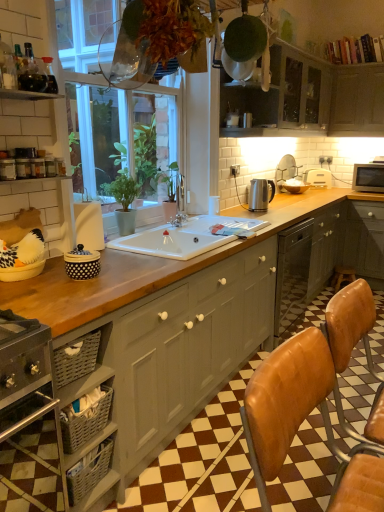
Image resolution: width=384 pixels, height=512 pixels. I want to click on white tiled window at upper left, so click(x=110, y=106).

The width and height of the screenshot is (384, 512). Describe the element at coordinates (110, 106) in the screenshot. I see `white tiled window at upper left` at that location.

Describe the element at coordinates (82, 263) in the screenshot. The height and width of the screenshot is (512, 384). I see `polka dot ceramic jar at left, which is the seventh appliance from back to front` at that location.

Describe the element at coordinates (318, 177) in the screenshot. The image size is (384, 512). I see `white plastic toaster at upper right, which ranks as the 2th appliance in right-to-left order` at that location.

Describe the element at coordinates (176, 239) in the screenshot. I see `white ceramic sink at center` at that location.

Locate an element on the screen. The image size is (384, 512). metallic silver kettle at upper center, positioned as the second appliance in left-to-right order is located at coordinates (232, 119).

From the image's perspective, is matte gray cabinets at upper center, positioned as the 2th cabinetry in left-to-right order, above metallic silver kettle at upper center, which is the 6th appliance in back-to-front order?

Yes.

Is matte gray cabinets at upper center, positioned as the 2th cabinetry in left-to-right order, bigger than metallic silver kettle at upper center, which is the sixth appliance from right to left?

Correct, matte gray cabinets at upper center, positioned as the 2th cabinetry in left-to-right order, is larger in size than metallic silver kettle at upper center, which is the sixth appliance from right to left.

Is matte gray cabinets at upper center, the second cabinetry from the bottom, at the right side of metallic silver kettle at upper center, which is the 6th appliance in back-to-front order?

Indeed, matte gray cabinets at upper center, the second cabinetry from the bottom, is positioned on the right side of metallic silver kettle at upper center, which is the 6th appliance in back-to-front order.

Is matte gray cabinets at upper center, the second cabinetry from the bottom, facing towards metallic silver kettle at upper center, positioned as the second appliance in left-to-right order?

No, matte gray cabinets at upper center, the second cabinetry from the bottom, is not oriented towards metallic silver kettle at upper center, positioned as the second appliance in left-to-right order.

Is leather at right bigger or smaller than matte gray cabinet at center, which is counted as the 3th cabinetry, starting from the right?

Clearly, leather at right is smaller in size than matte gray cabinet at center, which is counted as the 3th cabinetry, starting from the right.

From a real-world perspective, who is located higher, leather at right or matte gray cabinet at center, positioned as the first cabinetry in bottom-to-top order?

From a 3D spatial view, leather at right is above.

Is leather at right closer to the viewer compared to matte gray cabinet at center, positioned as the first cabinetry in bottom-to-top order?

Yes, leather at right is closer to the viewer.

From the image's perspective, count 1st cabinetrys upward from the leather at right and point to it. Please provide its 2D coordinates.

[(184, 350)]

Based on their positions, is satin nickel toaster at upper right, acting as the 4th appliance starting from the back, located to the left or right of metallic silver kettle at upper center, which is the 6th appliance in back-to-front order?

From the image, it's evident that satin nickel toaster at upper right, acting as the 4th appliance starting from the back, is to the right of metallic silver kettle at upper center, which is the 6th appliance in back-to-front order.

Who is more distant, satin nickel toaster at upper right, which is the 4th appliance from right to left, or metallic silver kettle at upper center, positioned as the second appliance in left-to-right order?

Positioned behind is satin nickel toaster at upper right, which is the 4th appliance from right to left.

Is satin nickel toaster at upper right, marked as the fourth appliance in a left-to-right arrangement, oriented towards metallic silver kettle at upper center, which is the 6th appliance in back-to-front order?

No, satin nickel toaster at upper right, marked as the fourth appliance in a left-to-right arrangement, is not oriented towards metallic silver kettle at upper center, which is the 6th appliance in back-to-front order.

Relative to polka dot ceramic jar at left, which is the seventh appliance from back to front, is metallic silver kettle at upper center, which is the 6th appliance in back-to-front order, in front or behind?

Clearly, metallic silver kettle at upper center, which is the 6th appliance in back-to-front order, is behind polka dot ceramic jar at left, which is the seventh appliance from back to front.

Is metallic silver kettle at upper center, positioned as the second appliance in left-to-right order, outside of polka dot ceramic jar at left, placed as the first appliance when sorted from front to back?

Indeed, metallic silver kettle at upper center, positioned as the second appliance in left-to-right order, is completely outside polka dot ceramic jar at left, placed as the first appliance when sorted from front to back.

Can you confirm if metallic silver kettle at upper center, which is the sixth appliance from right to left, is positioned to the right of polka dot ceramic jar at left, which is the 7th appliance in right-to-left order?

Correct, you'll find metallic silver kettle at upper center, which is the sixth appliance from right to left, to the right of polka dot ceramic jar at left, which is the 7th appliance in right-to-left order.

In the image, is polka dot ceramic jar at left, which is the seventh appliance from back to front, on the left side or the right side of white ceramic sink at center?

In the image, polka dot ceramic jar at left, which is the seventh appliance from back to front, appears on the left side of white ceramic sink at center.

Could white ceramic sink at center be considered to be inside polka dot ceramic jar at left, which is the seventh appliance from back to front?

No.

Which of these two, polka dot ceramic jar at left, the 1th appliance viewed from the left, or white ceramic sink at center, is wider?

With larger width is white ceramic sink at center.

Does point (92, 259) lie in front of point (143, 249)?

Yes, point (92, 259) is closer to viewer.

Is satin nickel toaster at upper right, which is the 4th appliance from front to back, oriented away from matte gray cabinet at upper center, placed as the third cabinetry when sorted from bottom to top?

satin nickel toaster at upper right, which is the 4th appliance from front to back, does not have its back to matte gray cabinet at upper center, placed as the third cabinetry when sorted from bottom to top.

From a real-world perspective, which is physically below, satin nickel toaster at upper right, which is the 4th appliance from right to left, or matte gray cabinet at upper center, the first cabinetry viewed from the right?

satin nickel toaster at upper right, which is the 4th appliance from right to left, from a real-world perspective.

Considering the relative sizes of satin nickel toaster at upper right, marked as the fourth appliance in a left-to-right arrangement, and matte gray cabinet at upper center, which is the third cabinetry from left to right, in the image provided, is satin nickel toaster at upper right, marked as the fourth appliance in a left-to-right arrangement, wider than matte gray cabinet at upper center, which is the third cabinetry from left to right,?

No.

Between white tiled window at upper left and leather at right, which one appears on the left side from the viewer's perspective?

white tiled window at upper left is more to the left.

Is white tiled window at upper left further to camera compared to leather at right?

Yes, white tiled window at upper left is further from the viewer.

Between white tiled window at upper left and leather at right, which one has larger size?

white tiled window at upper left is bigger.

From a real-world perspective, is white tiled window at upper left beneath leather at right?

No, from a real-world perspective, white tiled window at upper left is not under leather at right.

From a real-world perspective, which cabinetry is the 1st one above the metallic silver kettle at upper center, positioned as the second appliance in left-to-right order? Please provide its 2D coordinates.

[(308, 97)]

You are a GUI agent. You are given a task and a screenshot of the screen. Output one action in this format:
    pyautogui.click(x=<x>, y=<y>)
    Task: Click on the 1st cabinetry behind the leather at right
    
    Given the screenshot: What is the action you would take?
    pos(184,350)

Based on their spatial positions, is leather at right or white plastic toaster at upper right, which ranks as the 2th appliance in right-to-left order, further from white tiled window at upper left?

Based on the image, leather at right appears to be further to white tiled window at upper left.

Estimate the real-world distances between objects in this image. Which object is further from matte gray cabinets at upper center, the second cabinetry from the bottom, satin nickel toaster at upper right, marked as the fourth appliance in a left-to-right arrangement, or silver metallic kettle at center, the fifth appliance from the left?

silver metallic kettle at center, the fifth appliance from the left, lies further to matte gray cabinets at upper center, the second cabinetry from the bottom, than the other object.

Estimate the real-world distances between objects in this image. Which object is closer to satin silver kettle at counter top, which is the third appliance from front to back, satin nickel toaster at upper right, acting as the 4th appliance starting from the back, or leather at right?

satin nickel toaster at upper right, acting as the 4th appliance starting from the back, is closer to satin silver kettle at counter top, which is the third appliance from front to back.

Considering their positions, is polka dot ceramic jar at left, which is the seventh appliance from back to front, positioned further to silver metallic kettle at center, the fifth appliance from the left, than matte gray cabinets at upper center, the second cabinetry positioned from the top?

polka dot ceramic jar at left, which is the seventh appliance from back to front.

When comparing their distances from polka dot ceramic jar at left, the 1th appliance viewed from the left, does matte gray cabinets at upper center, the second cabinetry viewed from the right, or brown leather bar stool at lower right seem further?

brown leather bar stool at lower right is positioned further to the anchor polka dot ceramic jar at left, the 1th appliance viewed from the left.

Which object lies nearer to the anchor point white plastic toaster at upper right, the seventh appliance positioned from the front, matte gray cabinet at center, which is counted as the 3th cabinetry, starting from the right, or satin silver kettle at counter top, which ranks as the fifth appliance in right-to-left order?

satin silver kettle at counter top, which ranks as the fifth appliance in right-to-left order, lies closer to white plastic toaster at upper right, the seventh appliance positioned from the front, than the other object.

When comparing their distances from satin nickel toaster at upper right, which is the 4th appliance from front to back, does metallic silver kettle at upper center, which is the sixth appliance from right to left, or polka dot ceramic jar at left, the 1th appliance viewed from the left, seem closer?

metallic silver kettle at upper center, which is the sixth appliance from right to left, is closer to satin nickel toaster at upper right, which is the 4th appliance from front to back.

From the picture: Based on their spatial positions, is silver metallic kettle at center, the fifth appliance from the left, or matte black microwave at upper right, marked as the seventh appliance in a left-to-right arrangement, further from matte gray cabinet at center, positioned as the first cabinetry in bottom-to-top order?

matte black microwave at upper right, marked as the seventh appliance in a left-to-right arrangement, is positioned further to the anchor matte gray cabinet at center, positioned as the first cabinetry in bottom-to-top order.

The height and width of the screenshot is (512, 384). Find the location of `appliance between silver metallic kettle at center, which ranks as the 3th appliance in right-to-left order, and matte black microwave at upper right, marked as the first appliance in a right-to-left arrangement`. appliance between silver metallic kettle at center, which ranks as the 3th appliance in right-to-left order, and matte black microwave at upper right, marked as the first appliance in a right-to-left arrangement is located at coordinates (318, 177).

The height and width of the screenshot is (512, 384). Identify the location of window between polka dot ceramic jar at left, which is the seventh appliance from back to front, and satin nickel toaster at upper right, acting as the 4th appliance starting from the back, along the z-axis. click(x=110, y=106).

The image size is (384, 512). Find the location of `appliance positioned between leather at right and metallic silver kettle at upper center, which is the sixth appliance from right to left, from near to far`. appliance positioned between leather at right and metallic silver kettle at upper center, which is the sixth appliance from right to left, from near to far is located at coordinates (82, 263).

Where is `window between leather at right and white plastic toaster at upper right, placed as the 6th appliance when sorted from left to right, along the z-axis`? The height and width of the screenshot is (512, 384). window between leather at right and white plastic toaster at upper right, placed as the 6th appliance when sorted from left to right, along the z-axis is located at coordinates (110, 106).